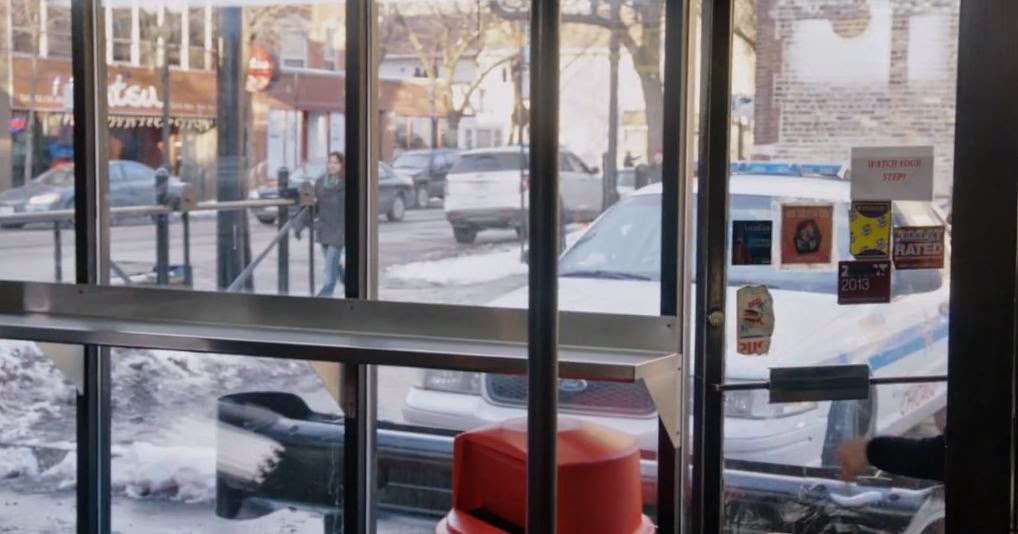
What are the coordinates of `brick wall` in the screenshot? It's located at (856, 115), (813, 117), (924, 121).